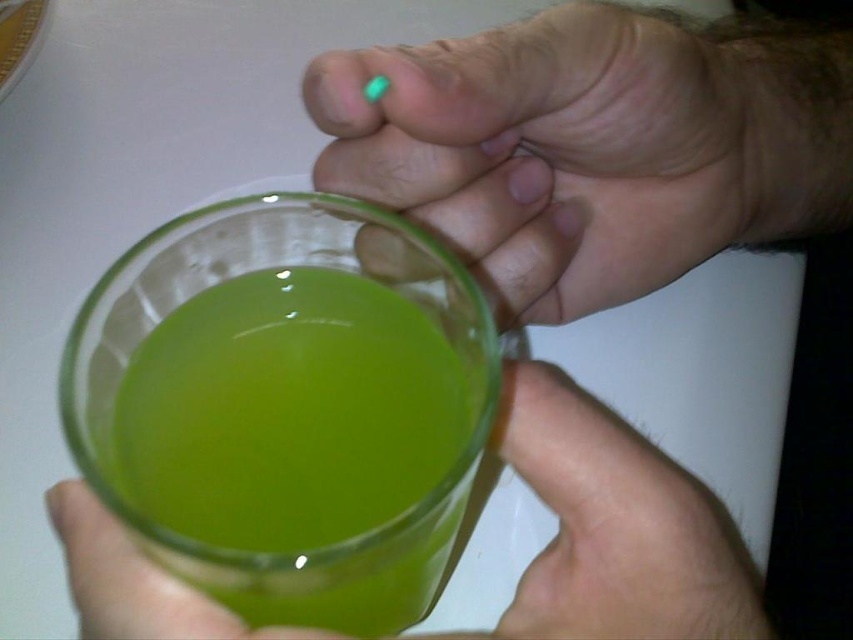
Can you confirm if matte green glass at upper center is positioned to the left of transparent glass cup at center?

In fact, matte green glass at upper center is to the right of transparent glass cup at center.

Who is higher up, matte green glass at upper center or transparent glass cup at center?

matte green glass at upper center

Who is more forward, (651, 35) or (112, 636)?

Point (112, 636) is in front.

The image size is (853, 640). I want to click on matte green glass at upper center, so click(550, 150).

Is green translucent liquid at center to the left of transparent glass cup at center from the viewer's perspective?

Indeed, green translucent liquid at center is positioned on the left side of transparent glass cup at center.

Between green translucent liquid at center and transparent glass cup at center, which one has more height?

green translucent liquid at center

Is point (225, 360) positioned behind point (538, 561)?

No, (225, 360) is closer to viewer.

Where is `green translucent liquid at center`? Image resolution: width=853 pixels, height=640 pixels. green translucent liquid at center is located at coordinates (288, 412).

Measure the distance between matte green glass at upper center and camera.

The distance of matte green glass at upper center from camera is 7.81 inches.

Is matte green glass at upper center to the right of green translucent liquid at center from the viewer's perspective?

Yes, matte green glass at upper center is to the right of green translucent liquid at center.

Image resolution: width=853 pixels, height=640 pixels. What do you see at coordinates (550, 150) in the screenshot?
I see `matte green glass at upper center` at bounding box center [550, 150].

I want to click on matte green glass at upper center, so click(550, 150).